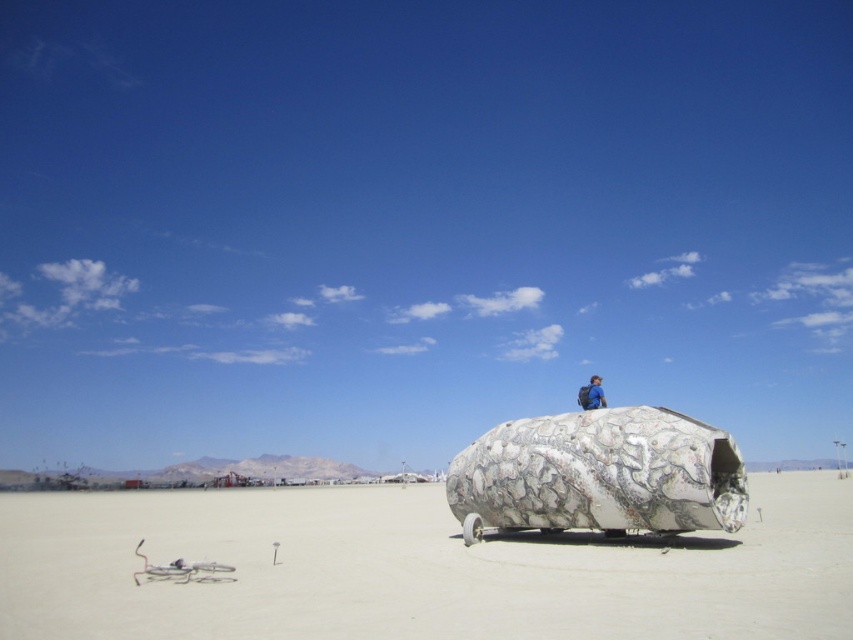
Question: Which object is closer to the camera taking this photo?

Choices:
 (A) blue backpack at center
 (B) white sand at center

Answer: (B)

Question: Observing the image, what is the correct spatial positioning of white sand at center in reference to blue backpack at center?

Choices:
 (A) left
 (B) right

Answer: (B)

Question: Which of the following is the closest to the observer?

Choices:
 (A) blue backpack at center
 (B) white sand at center

Answer: (B)

Question: Is white sand at center thinner than blue backpack at center?

Choices:
 (A) no
 (B) yes

Answer: (A)

Question: Can you confirm if white sand at center is bigger than blue backpack at center?

Choices:
 (A) yes
 (B) no

Answer: (A)